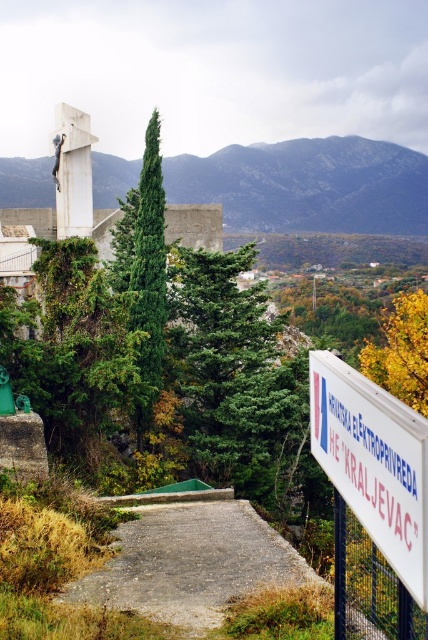
Question: Is green matte tree at center positioned behind metallic wire mesh at lower right?

Choices:
 (A) no
 (B) yes

Answer: (B)

Question: Can you confirm if green matte tree at center is bigger than green leafy trees at upper center?

Choices:
 (A) yes
 (B) no

Answer: (B)

Question: Among these points, which one is nearest to the camera?

Choices:
 (A) (262, 211)
 (B) (419, 356)
 (C) (267, 536)
 (D) (216, 417)

Answer: (C)

Question: Among these points, which one is farthest from the camera?

Choices:
 (A) (119, 547)
 (B) (422, 392)
 (C) (422, 499)
 (D) (234, 472)

Answer: (D)

Question: Which point appears farthest from the camera in this image?

Choices:
 (A) (394, 328)
 (B) (226, 305)
 (C) (401, 611)
 (D) (386, 202)

Answer: (D)

Question: Does green matte tree at center appear on the right side of white plastic sign at right?

Choices:
 (A) no
 (B) yes

Answer: (B)